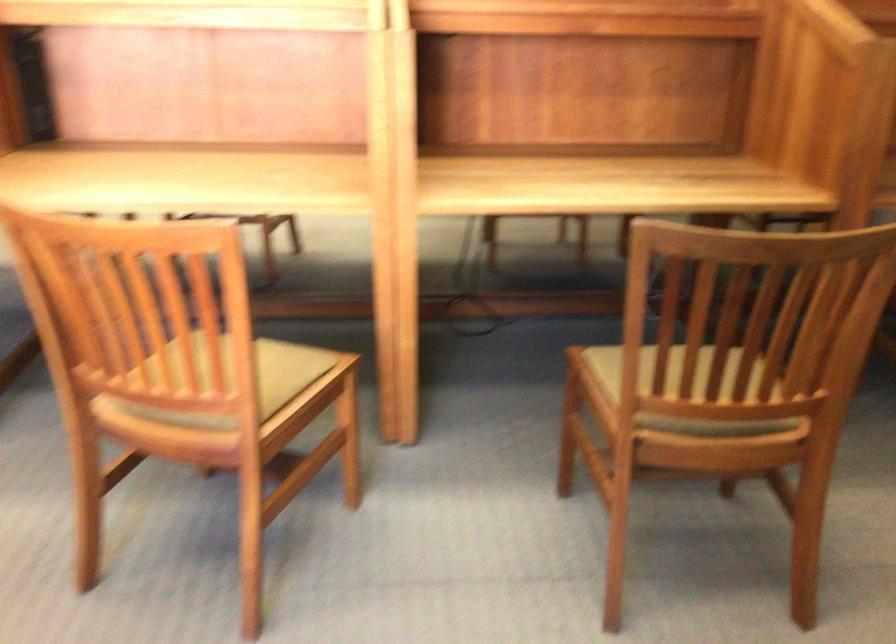
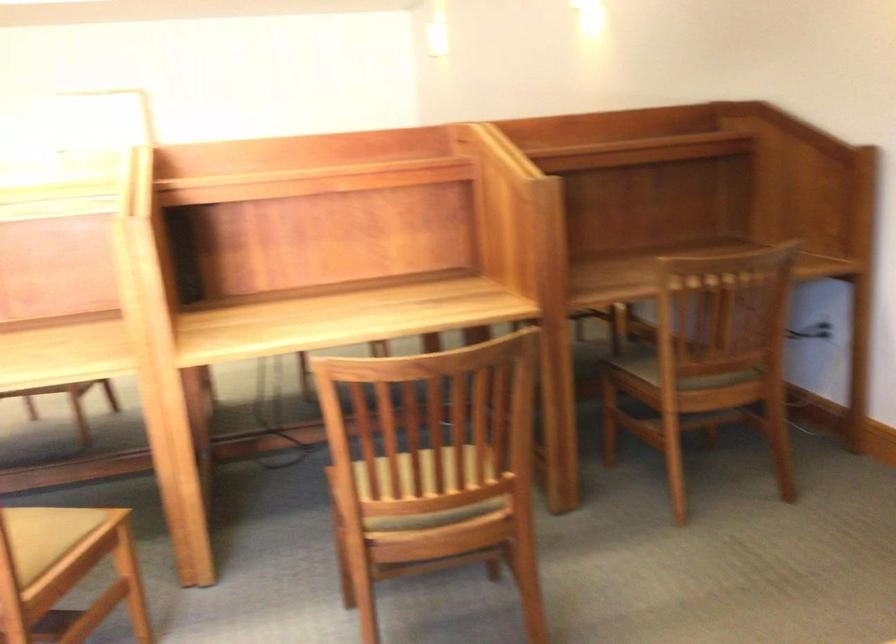
Where in the second image is the point corresponding to [289,377] from the first image?

(62, 536)